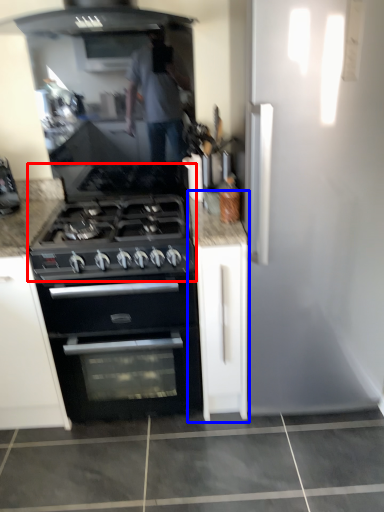
Question: Which point is closer to the camera, gas stove (highlighted by a red box) or cabinetry (highlighted by a blue box)?

Choices:
 (A) gas stove
 (B) cabinetry

Answer: (A)